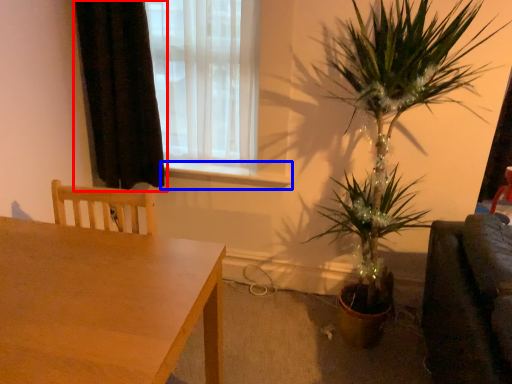
Question: Which point is closer to the camera, curtain (highlighted by a red box) or window sill (highlighted by a blue box)?

Choices:
 (A) curtain
 (B) window sill

Answer: (A)